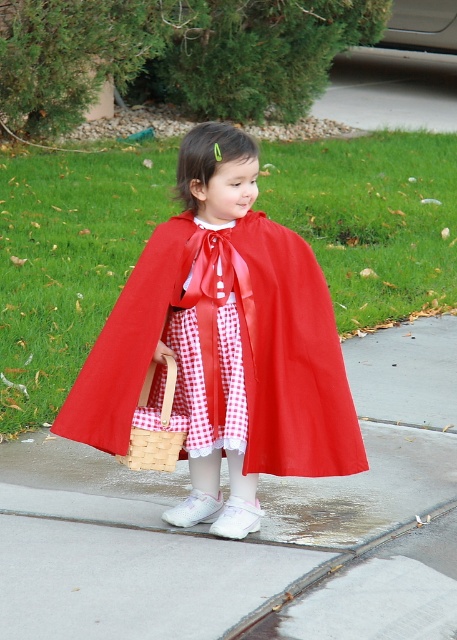
Question: Among these objects, which one is farthest from the camera?

Choices:
 (A) smooth concrete pavement at center
 (B) red checkered fabric dress at center
 (C) woven wood basket at center

Answer: (C)

Question: Can you confirm if red checkered fabric dress at center is positioned to the left of woven wood basket at center?

Choices:
 (A) no
 (B) yes

Answer: (A)

Question: Does smooth concrete pavement at center appear under red checkered fabric dress at center?

Choices:
 (A) no
 (B) yes

Answer: (B)

Question: Which object appears closest to the camera in this image?

Choices:
 (A) red checkered fabric dress at center
 (B) smooth concrete pavement at center
 (C) woven wood basket at center

Answer: (B)

Question: Estimate the real-world distances between objects in this image. Which object is closer to the smooth concrete pavement at center?

Choices:
 (A) red checkered fabric dress at center
 (B) woven wood basket at center

Answer: (B)

Question: Can you confirm if red checkered fabric dress at center is positioned below woven wood basket at center?

Choices:
 (A) no
 (B) yes

Answer: (A)